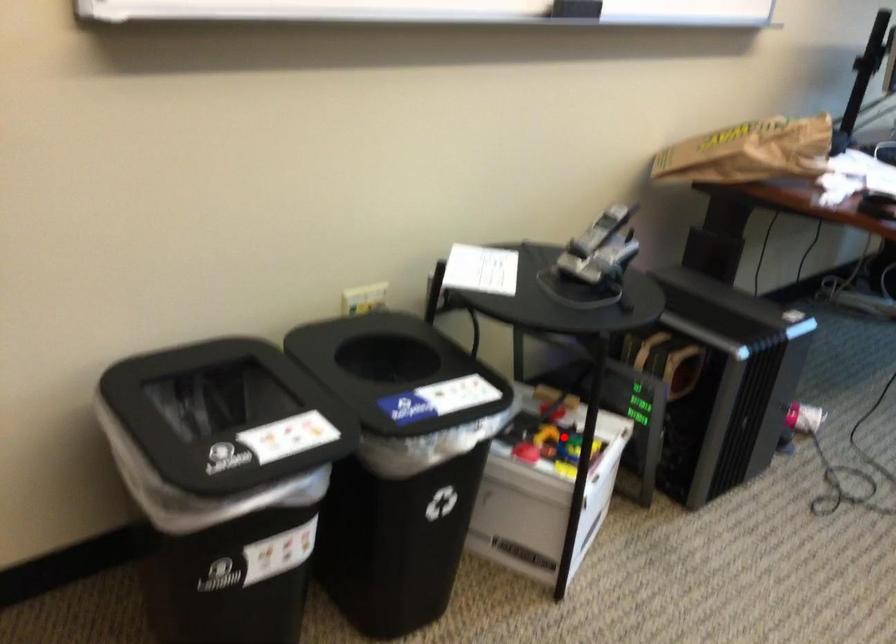
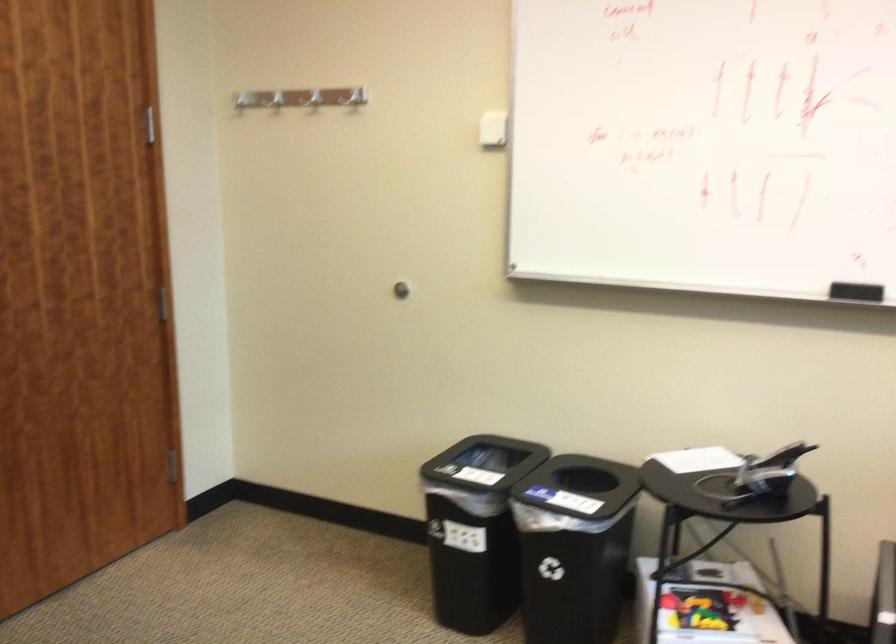
Question: I am providing you with two images of the same scene from different viewpoints. A red point is shown in image1. For the corresponding object point in image2, is it positioned nearer or farther from the camera?

Choices:
 (A) Nearer
 (B) Farther

Answer: (B)